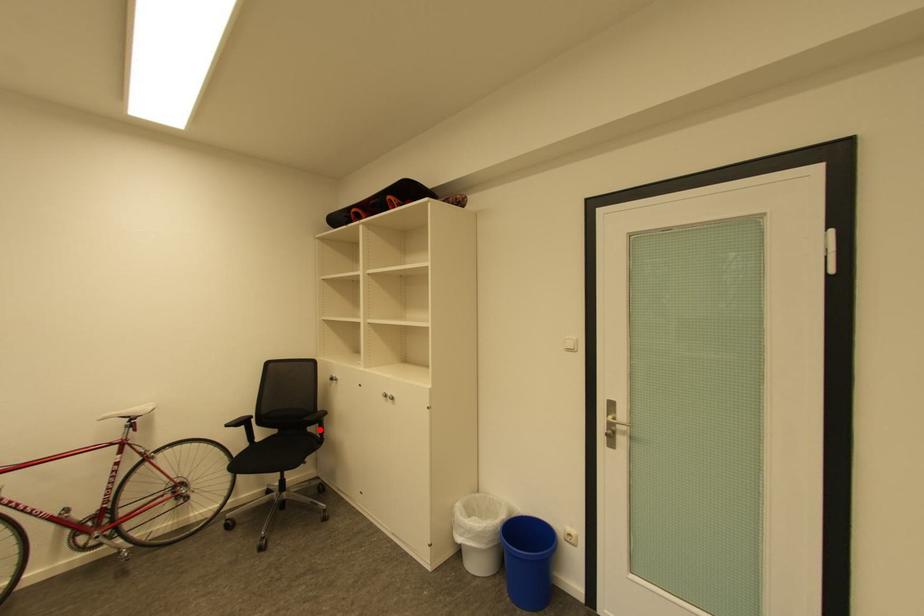
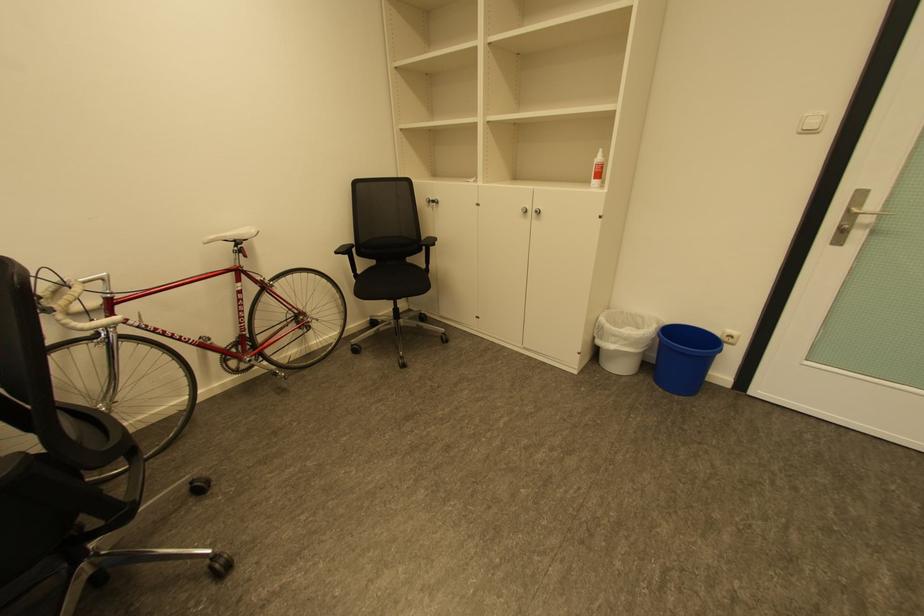
Question: I am providing you with two images of the same scene from different viewpoints. A red point is shown in image1. For the corresponding object point in image2, is it positioned nearer or farther from the camera?

Choices:
 (A) Nearer
 (B) Farther

Answer: (A)